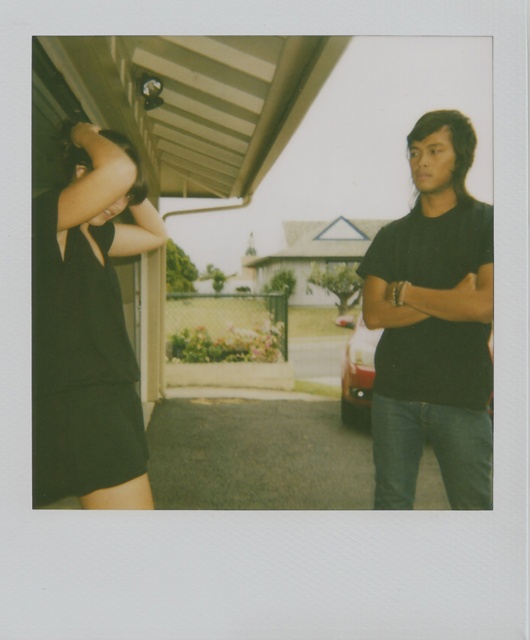
Question: Is black matte t-shirt at right closer to the viewer compared to black matte dress at left?

Choices:
 (A) yes
 (B) no

Answer: (B)

Question: Is black matte t-shirt at right wider than metallic silver car at center?

Choices:
 (A) no
 (B) yes

Answer: (B)

Question: Estimate the real-world distances between objects in this image. Which object is closer to the black matte t-shirt at right?

Choices:
 (A) black matte dress at left
 (B) metallic silver car at center

Answer: (A)

Question: Does black matte t-shirt at right appear over metallic silver car at center?

Choices:
 (A) yes
 (B) no

Answer: (A)

Question: Which point appears closest to the camera in this image?

Choices:
 (A) (66, 212)
 (B) (355, 371)
 (C) (489, 422)

Answer: (A)

Question: Which point is closer to the camera?

Choices:
 (A) (372, 376)
 (B) (69, 132)

Answer: (B)